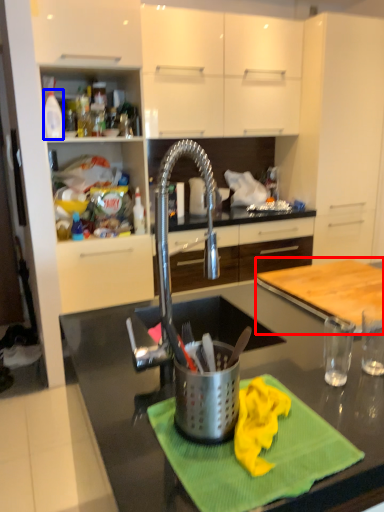
Question: Which object appears closest to the camera in this image, counter (highlighted by a red box) or kitchen appliance (highlighted by a blue box)?

Choices:
 (A) counter
 (B) kitchen appliance

Answer: (A)